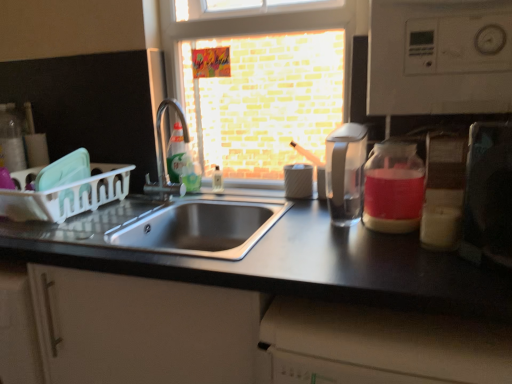
In order to click on free space in front of pink translucent glass jar at right in this screenshot , I will do `click(385, 257)`.